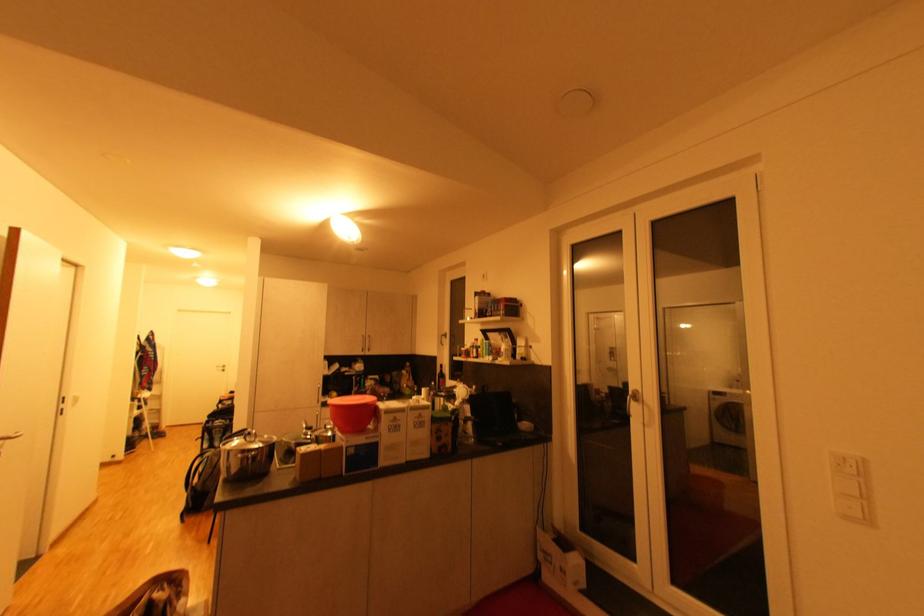
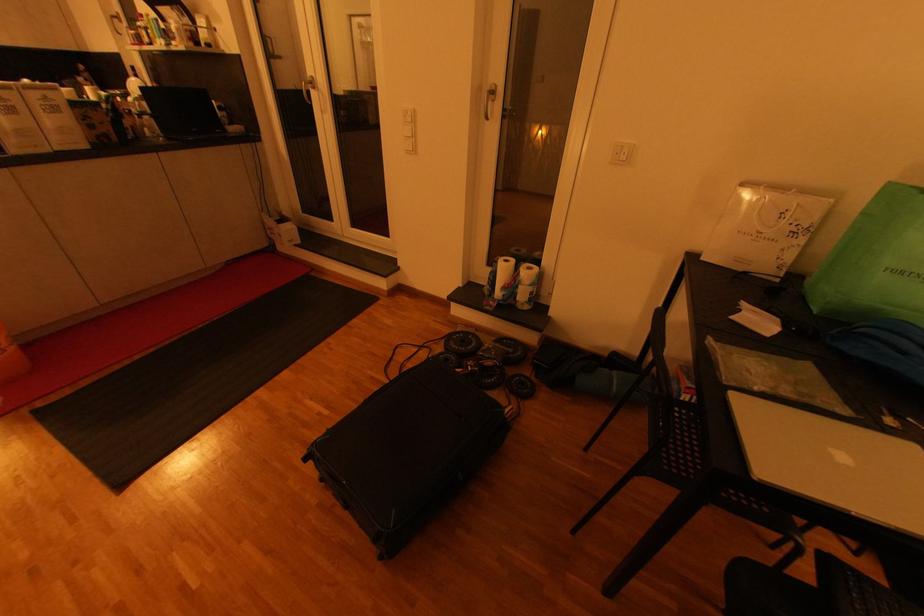
Locate, in the second image, the point that corresponds to point (857, 463) in the first image.

(415, 114)